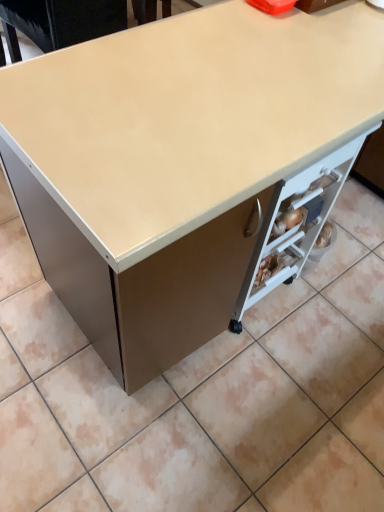
The height and width of the screenshot is (512, 384). I want to click on vacant area that lies to the right of matte white drawer at lower right, so click(x=327, y=306).